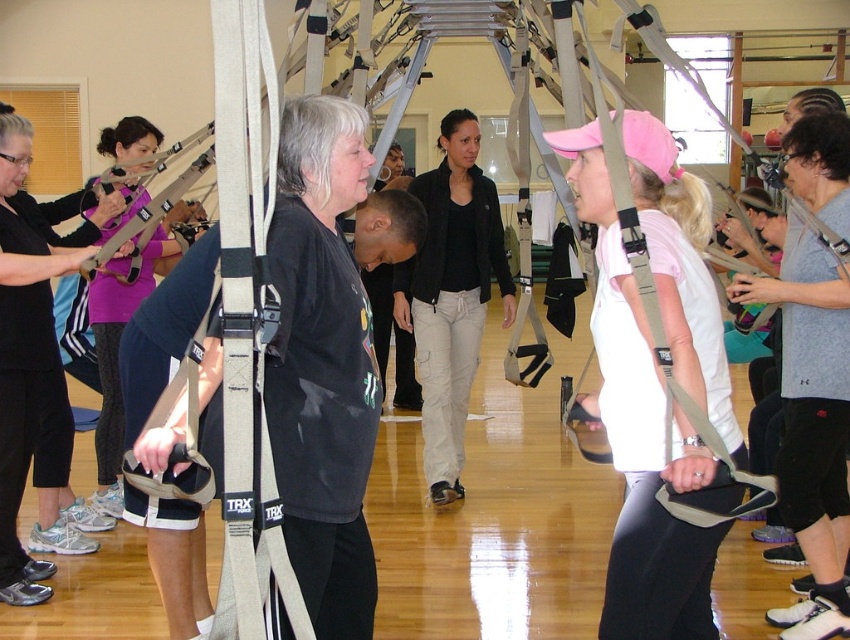
Question: Is matte black shirt at center closer to camera compared to black cotton jacket at center?

Choices:
 (A) yes
 (B) no

Answer: (A)

Question: Which object is the farthest from the black cotton jacket at center?

Choices:
 (A) matte black shirt at center
 (B) gray cotton shirt at center

Answer: (A)

Question: Can you confirm if matte black shirt at center is smaller than gray cotton shirt at center?

Choices:
 (A) yes
 (B) no

Answer: (A)

Question: Does matte black shirt at center have a larger size compared to gray cotton shirt at center?

Choices:
 (A) no
 (B) yes

Answer: (A)

Question: Among these objects, which one is farthest from the camera?

Choices:
 (A) matte black shirt at center
 (B) gray cotton shirt at center

Answer: (B)

Question: Which point is farther to the camera?

Choices:
 (A) (842, 524)
 (B) (446, 493)

Answer: (B)